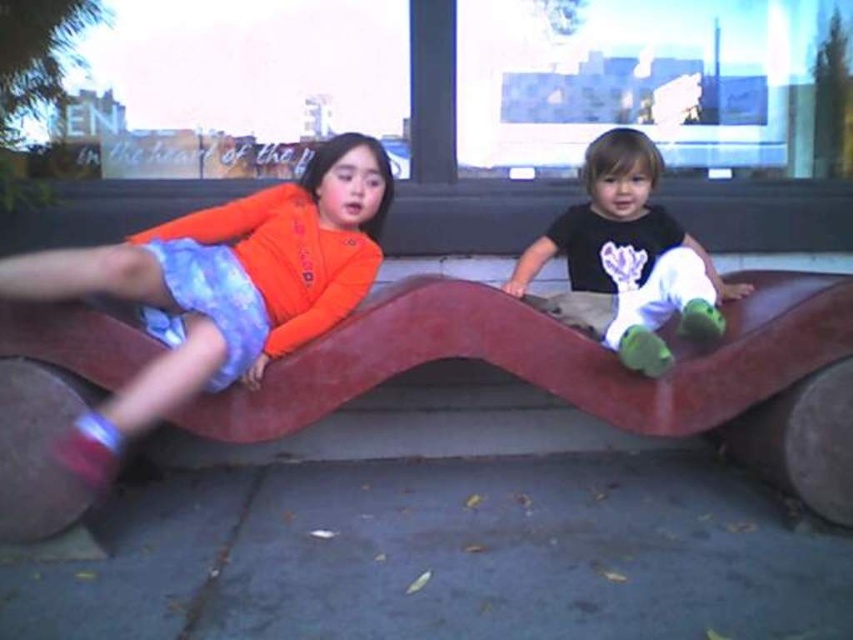
You are a photographer trying to capture both children in the scene. Since the matte orange shirt at upper left and the matte black shirt at upper right are different in size, which child should you focus on first to ensure they are in frame?

The matte orange shirt at upper left is bigger than the matte black shirt at upper right, so you should focus on the child with the matte orange shirt at upper left first to ensure they are in frame since they take up more space.

You are standing in front of the playground structure and want to place a small sticker at the point with coordinates point (223, 285). Which object should you look for to place the sticker correctly?

You should look for the matte orange shirt at upper left to place the sticker at point (223, 285) because the point is on that object.

You are a photographer trying to capture both children in a photo. Since the matte orange shirt at upper left and the matte black shirt at upper right are at different heights, which child should you focus on first to ensure both are in frame?

You should focus on the matte orange shirt at upper left first because it has a greater height compared to the matte black shirt at upper right, so adjusting the camera angle to include its higher position will naturally include the lower positioned child as well.